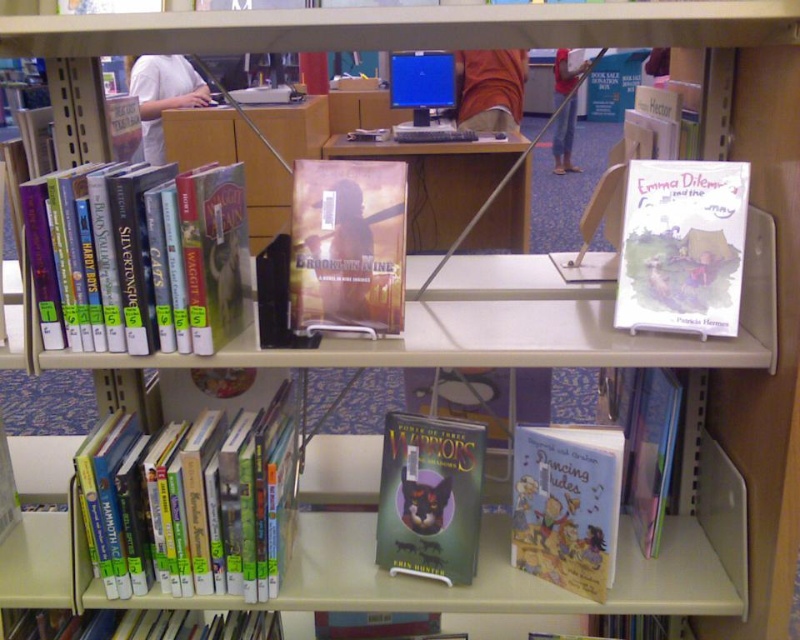
Question: Which object appears farthest from the camera in this image?

Choices:
 (A) matte brown book at center
 (B) white paper book at upper right
 (C) hardcover books at left
 (D) green matte book at center

Answer: (D)

Question: Observing the image, what is the correct spatial positioning of hardcover books at left in reference to hardcover book at lower center?

Choices:
 (A) left
 (B) right

Answer: (A)

Question: Is hardcover books at lower left above hardcover book at lower center?

Choices:
 (A) no
 (B) yes

Answer: (B)

Question: Does hardcover books at lower left appear on the right side of matte brown book at center?

Choices:
 (A) no
 (B) yes

Answer: (A)

Question: Which object appears farthest from the camera in this image?

Choices:
 (A) hardcover books at left
 (B) white paper book at upper right
 (C) hardcover book at lower left

Answer: (C)

Question: Among these objects, which one is farthest from the camera?

Choices:
 (A) hardcover book at lower left
 (B) matte brown book at center
 (C) white paper book at upper right
 (D) hardcover book at lower center

Answer: (A)